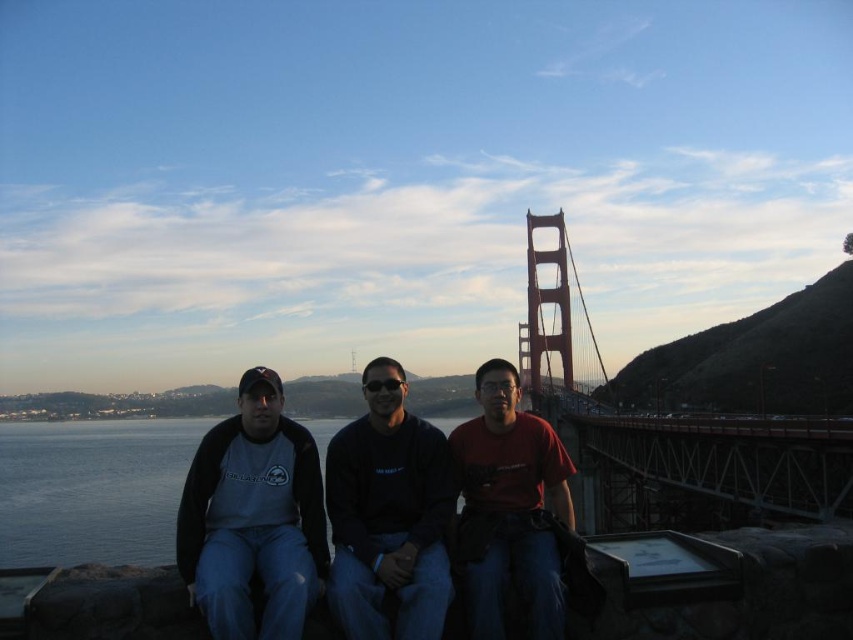
Question: Which point appears farthest from the camera in this image?

Choices:
 (A) (741, 365)
 (B) (822, 444)

Answer: (A)

Question: Can you confirm if matte black jacket at center is smaller than black matte sweatshirt at center?

Choices:
 (A) no
 (B) yes

Answer: (A)

Question: Is red matte shirt at center smaller than metallic steel bridge at center?

Choices:
 (A) yes
 (B) no

Answer: (B)

Question: Which object is closer to the camera taking this photo?

Choices:
 (A) metallic steel bridge at center
 (B) red matte shirt at center

Answer: (B)

Question: Does matte black jacket at center appear on the right side of red matte shirt at center?

Choices:
 (A) no
 (B) yes

Answer: (A)

Question: Which point is farther to the camera?

Choices:
 (A) metallic steel bridge at center
 (B) matte black jacket at center
 (C) metallic steel suspension bridge at right
 (D) matte gray sweatshirt at left

Answer: (A)